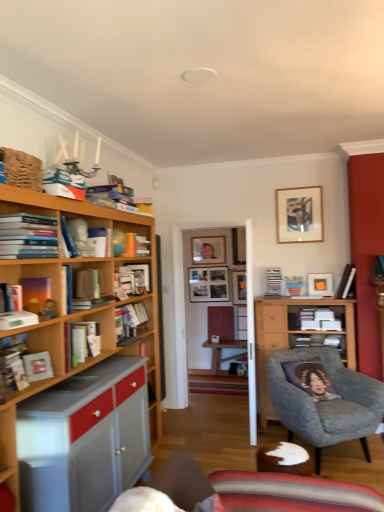
Question: Is hardcover book at left, which appears as the first book when viewed from the left, to the left of hardcover book at upper right, marked as the 1th book in a right-to-left arrangement, from the viewer's perspective?

Choices:
 (A) no
 (B) yes

Answer: (B)

Question: From the image's perspective, is hardcover book at left, the eleventh book from the back, above hardcover book at upper right, marked as the 1th book in a right-to-left arrangement?

Choices:
 (A) yes
 (B) no

Answer: (B)

Question: Is hardcover book at left, which is counted as the 12th book, starting from the right, behind hardcover book at upper right, which is the second book in back-to-front order?

Choices:
 (A) no
 (B) yes

Answer: (A)

Question: Does hardcover book at left, which is the 2th book from front to back, come in front of hardcover book at upper right, marked as the 1th book in a right-to-left arrangement?

Choices:
 (A) no
 (B) yes

Answer: (B)

Question: From a real-world perspective, is hardcover book at left, which is counted as the 12th book, starting from the right, positioned over hardcover book at upper right, marked as the 1th book in a right-to-left arrangement, based on gravity?

Choices:
 (A) no
 (B) yes

Answer: (A)

Question: From the image's perspective, is hardcover book at left, which is the sixth book from left to right, above or below hardcover book at center, the twelfth book in the front-to-back sequence?

Choices:
 (A) below
 (B) above

Answer: (A)

Question: Is hardcover book at left, which is the sixth book from left to right, in front of or behind hardcover book at center, which is the 1th book from back to front, in the image?

Choices:
 (A) front
 (B) behind

Answer: (A)

Question: In the image, is hardcover book at left, which is the sixth book from left to right, on the left side or the right side of hardcover book at center, which appears as the 11th book when viewed from the left?

Choices:
 (A) left
 (B) right

Answer: (A)

Question: Based on their sizes in the image, would you say hardcover book at left, the seventh book positioned from the right, is bigger or smaller than hardcover book at center, which is the 1th book from back to front?

Choices:
 (A) big
 (B) small

Answer: (B)

Question: Is hardcover books at left, which ranks as the 12th book in back-to-front order, inside the boundaries of hardcover book at upper right, which is the second book in back-to-front order, or outside?

Choices:
 (A) outside
 (B) inside

Answer: (A)

Question: From a real-world perspective, is hardcover books at left, which appears as the third book when viewed from the left, positioned above or below hardcover book at upper right, positioned as the 12th book in left-to-right order?

Choices:
 (A) above
 (B) below

Answer: (A)

Question: Visually, is hardcover books at left, which ranks as the 12th book in back-to-front order, positioned to the left or to the right of hardcover book at upper right, which appears as the 11th book when viewed from the front?

Choices:
 (A) right
 (B) left

Answer: (B)

Question: Does point (16, 224) appear closer or farther from the camera than point (345, 286)?

Choices:
 (A) closer
 (B) farther

Answer: (A)

Question: Looking at the image, does matte white picture frame at upper right, placed as the first picture frame when sorted from front to back, seem bigger or smaller compared to matte black picture frame at upper center, arranged as the first picture frame when viewed from the back?

Choices:
 (A) small
 (B) big

Answer: (A)

Question: From a real-world perspective, relative to matte black picture frame at upper center, positioned as the fourth picture frame in front-to-back order, is matte white picture frame at upper right, which is the 4th picture frame in back-to-front order, vertically above or below?

Choices:
 (A) above
 (B) below

Answer: (B)